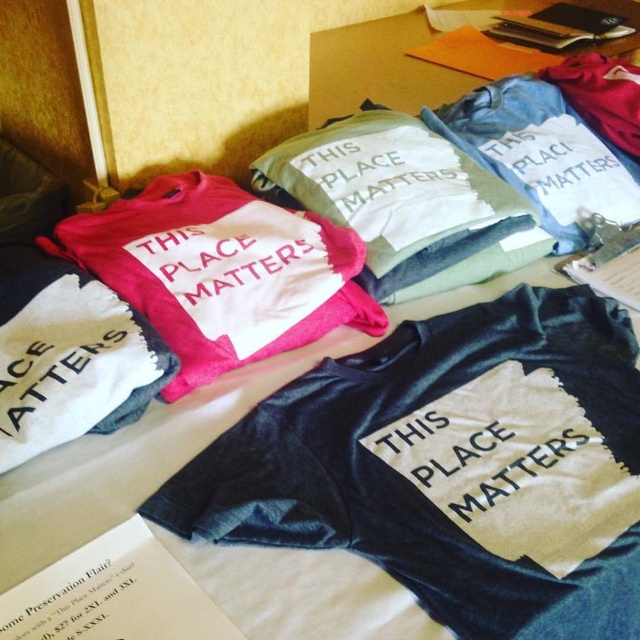
You are standing 5 feet away from the collection of folded T shirts on the table. If you move forward 1.5 feet, will the point at coordinates point (81,234) come into your immediate line of sight?

The distance of point (81,234) from viewer is 3.50 feet. Moving forward 1.5 feet reduces your distance to 3.5 feet, which is exactly at the point. However, since you are now at 3.5 feet away, the point would be directly in front of you, so yes, it would come into your immediate line of sight.